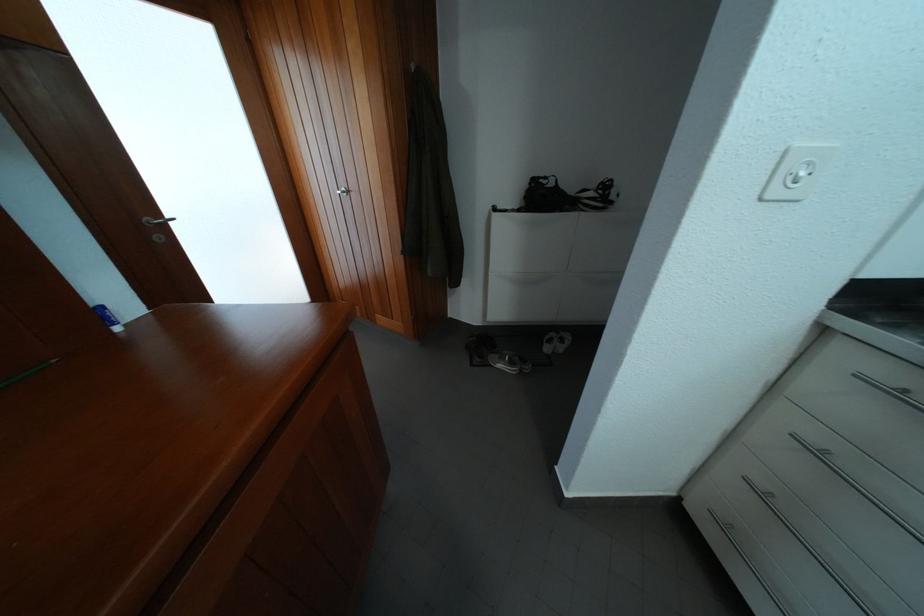
Image resolution: width=924 pixels, height=616 pixels. What do you see at coordinates (27, 373) in the screenshot?
I see `a green pencil` at bounding box center [27, 373].